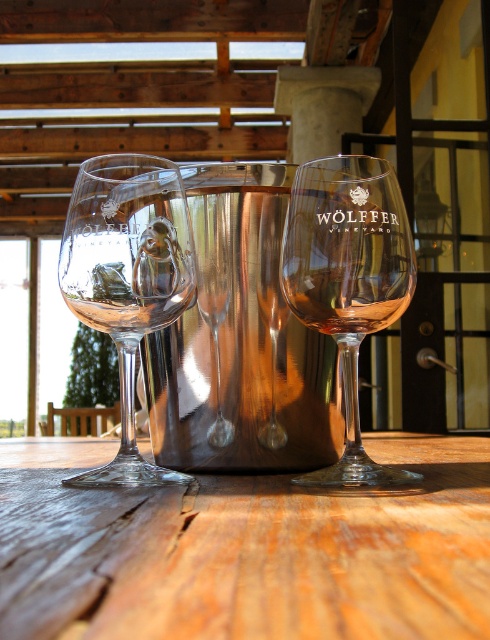
Does clear glass wine at center have a lesser height compared to clear glass wine at left?

No, clear glass wine at center is not shorter than clear glass wine at left.

Between clear glass wine at center and clear glass wine at left, which one appears on the left side from the viewer's perspective?

clear glass wine at left

In order to click on clear glass wine at center in this screenshot , I will do `click(345, 298)`.

The image size is (490, 640). Find the location of `clear glass wine at center`. clear glass wine at center is located at coordinates (345, 298).

How far apart are clear glass wine glass at left and clear glass wine at center?

clear glass wine glass at left is 5.65 centimeters from clear glass wine at center.

Measure the distance between clear glass wine glass at left and camera.

9.65 inches

This screenshot has width=490, height=640. Describe the element at coordinates (126, 278) in the screenshot. I see `clear glass wine glass at left` at that location.

Find the location of a particular element. clear glass wine glass at left is located at coordinates (126, 278).

This screenshot has width=490, height=640. Describe the element at coordinates (126, 278) in the screenshot. I see `clear glass wine glass at left` at that location.

This screenshot has width=490, height=640. Identify the location of clear glass wine glass at left. (126, 278).